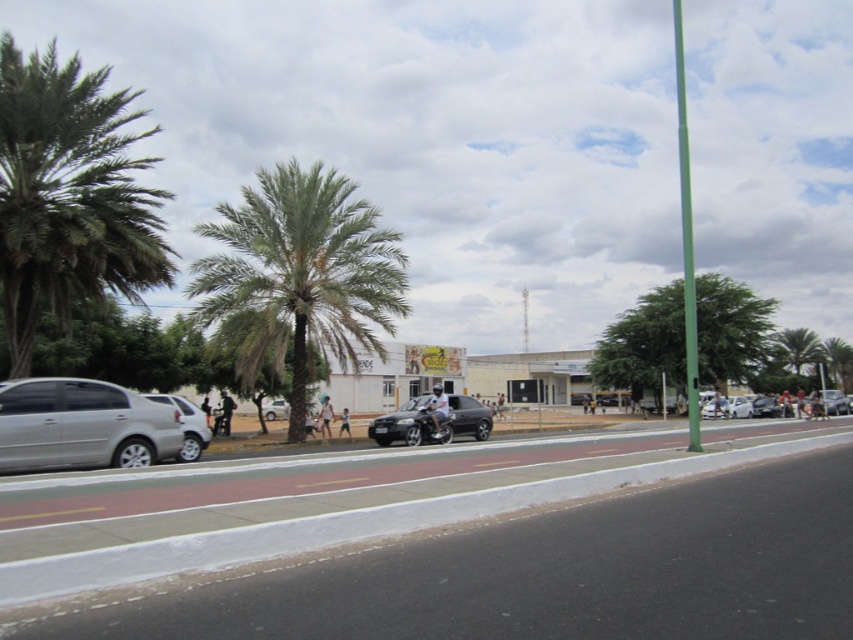
Between satin black car at center and shiny silver sedan at right, which one is positioned higher?

satin black car at center

Is satin black car at center taller than shiny silver sedan at right?

Yes.

Is point (457, 426) positioned before point (761, 412)?

Yes, point (457, 426) is in front of point (761, 412).

I want to click on satin black car at center, so [469, 417].

In the scene shown: Who is more distant from viewer, [19,442] or [273,412]?

Positioned behind is point [273,412].

Where is `satin silver sedan at left`? satin silver sedan at left is located at coordinates (80, 426).

Which is below, green leafy palm tree at center or silver metallic car at lower left?

silver metallic car at lower left

The height and width of the screenshot is (640, 853). What do you see at coordinates (299, 276) in the screenshot? I see `green leafy palm tree at center` at bounding box center [299, 276].

Locate an element on the screen. Image resolution: width=853 pixels, height=640 pixels. green leafy palm tree at center is located at coordinates (299, 276).

At what (x,y) coordinates should I click in order to perform the action: click on green leafy palm tree at center. Please return your answer as a coordinate pair (x, y). Looking at the image, I should click on (299, 276).